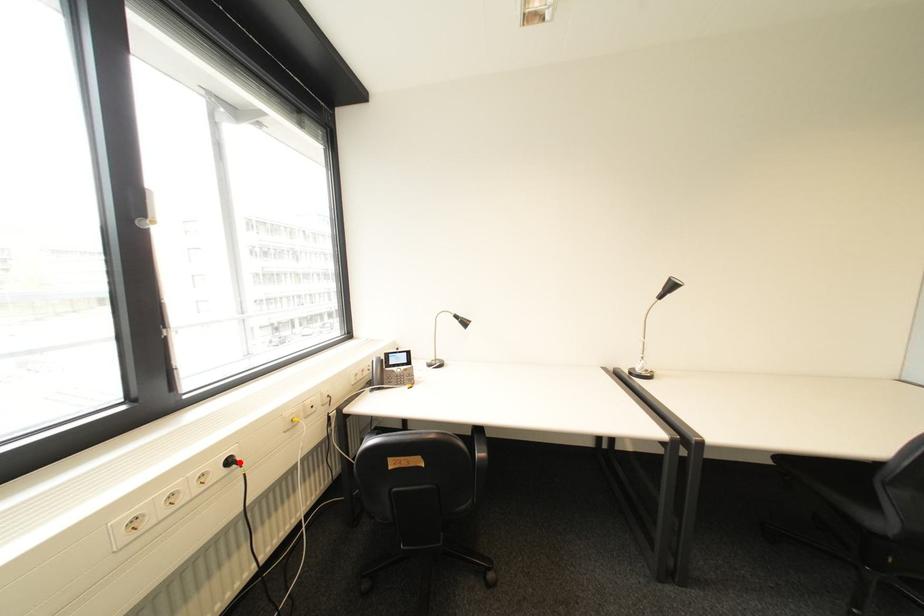
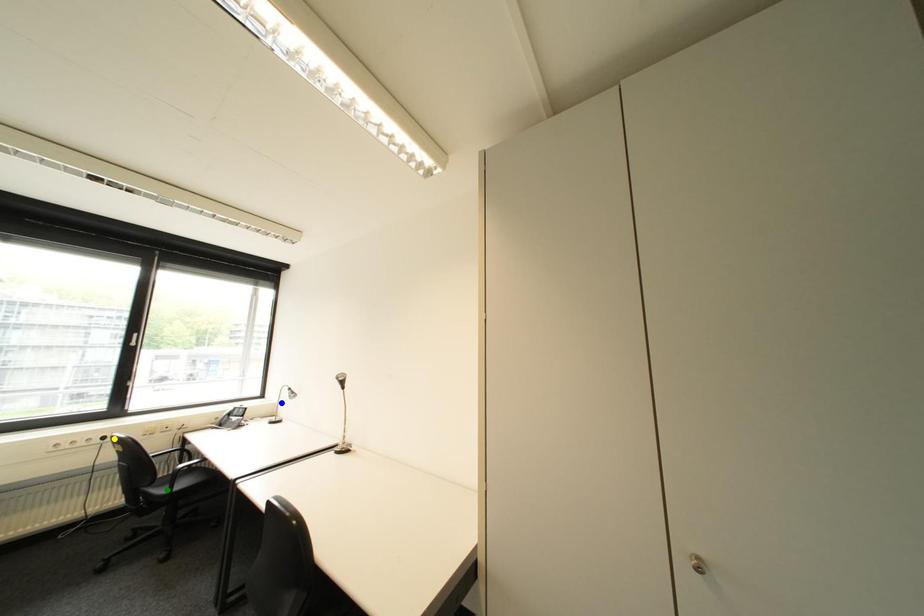
Question: I am providing you with two images of the same scene from different viewpoints. A red point is marked on the first image. You are given multiple points on the second image. Can you choose the point in image 2 that corresponds to the point in image 1?

Choices:
 (A) blue point
 (B) green point
 (C) yellow point

Answer: (C)